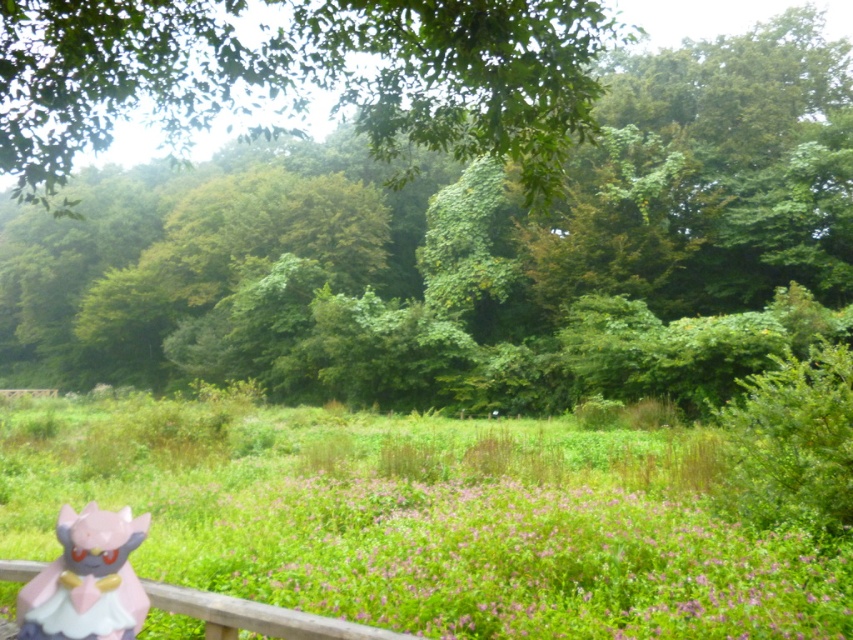
You are standing in a lush green landscape with a pink and gray figurine near a wooden railing. There are two points marked in the scene. Which point is closer to you, point 1 at coordinates (535, 481) or point 2 at coordinates (279, 125)?

Point 1 at coordinates (535, 481) is closer to you than point 2 at coordinates (279, 125).

You are standing at the viewpoint of the image and want to walk to the point marked as point (814, 61). Is this point within a safe walking distance for an average person?

The distance between the viewer and point (814, 61) is 40.36 meters, which is a reasonable walking distance for an average person. Therefore, it is safe to walk to that point.

You are standing at the wooden railing where the pink glossy figurine at lower left is placed. Looking towards the green leafy tree at center, is the tree located to your left or right side?

The green leafy tree at center is to the left of the pink glossy figurine at lower left, so when standing at the railing where the pink glossy figurine at lower left is placed, the tree would be to your left side.